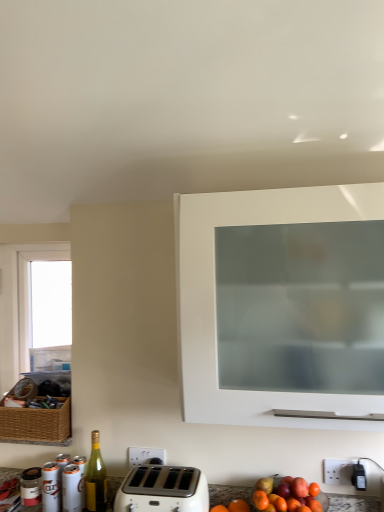
Question: Is the depth of transparent glass window at left greater than that of white plastic toaster at lower center?

Choices:
 (A) no
 (B) yes

Answer: (B)

Question: From a real-world perspective, is transparent glass window at left on white plastic toaster at lower center?

Choices:
 (A) yes
 (B) no

Answer: (A)

Question: Does transparent glass window at left appear on the left side of white plastic toaster at lower center?

Choices:
 (A) no
 (B) yes

Answer: (B)

Question: Is transparent glass window at left shorter than white plastic toaster at lower center?

Choices:
 (A) no
 (B) yes

Answer: (A)

Question: Considering the relative positions of transparent glass window at left and white plastic toaster at lower center in the image provided, is transparent glass window at left to the right of white plastic toaster at lower center from the viewer's perspective?

Choices:
 (A) no
 (B) yes

Answer: (A)

Question: From their relative heights in the image, would you say white plastic toaster at lower center is taller or shorter than green glass bottle at lower left?

Choices:
 (A) tall
 (B) short

Answer: (B)

Question: From a real-world perspective, is white plastic toaster at lower center physically located above or below green glass bottle at lower left?

Choices:
 (A) below
 (B) above

Answer: (A)

Question: Would you say white plastic toaster at lower center is to the left or to the right of green glass bottle at lower left in the picture?

Choices:
 (A) right
 (B) left

Answer: (A)

Question: Choose the correct answer: Is white plastic toaster at lower center inside green glass bottle at lower left or outside it?

Choices:
 (A) outside
 (B) inside

Answer: (A)

Question: In terms of height, does green glass bottle at lower left look taller or shorter compared to white plastic toaster at lower center?

Choices:
 (A) tall
 (B) short

Answer: (A)

Question: Visually, is green glass bottle at lower left positioned to the left or to the right of white plastic toaster at lower center?

Choices:
 (A) left
 (B) right

Answer: (A)

Question: Considering the positions of green glass bottle at lower left and white plastic toaster at lower center in the image, is green glass bottle at lower left wider or thinner than white plastic toaster at lower center?

Choices:
 (A) wide
 (B) thin

Answer: (B)

Question: From a real-world perspective, relative to white plastic toaster at lower center, is green glass bottle at lower left vertically above or below?

Choices:
 (A) below
 (B) above

Answer: (B)

Question: In terms of width, does transparent glass window at left look wider or thinner when compared to green glass bottle at lower left?

Choices:
 (A) thin
 (B) wide

Answer: (B)

Question: Considering their positions, is transparent glass window at left located in front of or behind green glass bottle at lower left?

Choices:
 (A) behind
 (B) front

Answer: (A)